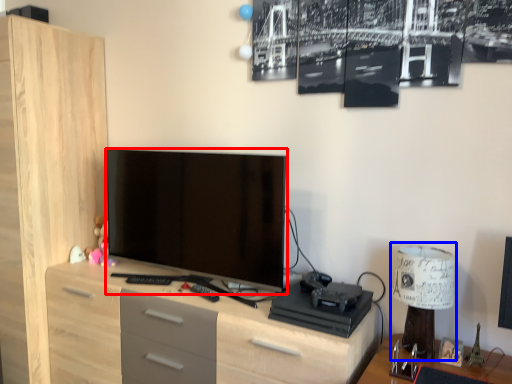
Question: Among these objects, which one is farthest to the camera, television (highlighted by a red box) or table lamp (highlighted by a blue box)?

Choices:
 (A) television
 (B) table lamp

Answer: (A)